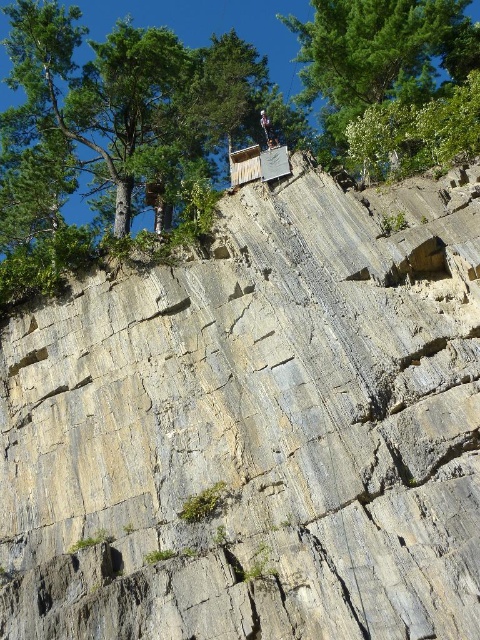
Question: Does green leafy tree at upper center lie in front of gray fabric rock climber at upper center?

Choices:
 (A) yes
 (B) no

Answer: (A)

Question: In this image, where is green leafy tree at upper center located relative to gray fabric rock climber at upper center?

Choices:
 (A) below
 (B) above

Answer: (B)

Question: In this image, where is green leafy tree at upper center located relative to gray fabric rock climber at upper center?

Choices:
 (A) below
 (B) above

Answer: (B)

Question: Which of the following is the closest to the observer?

Choices:
 (A) (266, 116)
 (B) (422, 80)

Answer: (B)

Question: Which point is closer to the camera?

Choices:
 (A) (468, 22)
 (B) (264, 113)

Answer: (A)